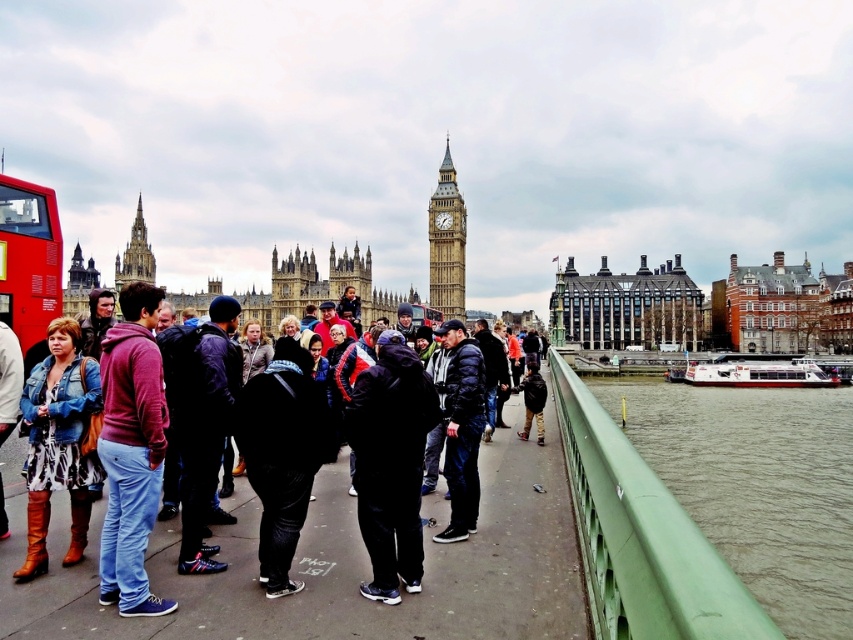
Between green rubber railing at lower right and red matte bus at left, which one appears on the left side from the viewer's perspective?

Positioned to the left is red matte bus at left.

In the scene shown: Can you confirm if green rubber railing at lower right is wider than red matte bus at left?

Indeed, green rubber railing at lower right has a greater width compared to red matte bus at left.

Which is behind, point (766, 465) or point (59, 257)?

Point (59, 257)

The image size is (853, 640). Find the location of `green rubber railing at lower right`. green rubber railing at lower right is located at coordinates (757, 484).

Which is behind, point (850, 461) or point (109, 513)?

The point (850, 461) is behind.

Is point (784, 541) positioned before point (157, 611)?

No, (784, 541) is behind (157, 611).

Is point (828, 465) closer to viewer compared to point (120, 536)?

No.

At what (x,y) coordinates should I click in order to perform the action: click on green rubber railing at lower right. Please return your answer as a coordinate pair (x, y). The image size is (853, 640). Looking at the image, I should click on (757, 484).

Can you confirm if red matte bus at left is smaller than stone spire at upper left?

Correct, red matte bus at left occupies less space than stone spire at upper left.

Between red matte bus at left and stone spire at upper left, which one appears on the left side from the viewer's perspective?

stone spire at upper left

You are a GUI agent. You are given a task and a screenshot of the screen. Output one action in this format:
    pyautogui.click(x=<x>, y=<y>)
    Task: Click on the red matte bus at left
    
    Given the screenshot: What is the action you would take?
    pyautogui.click(x=28, y=262)